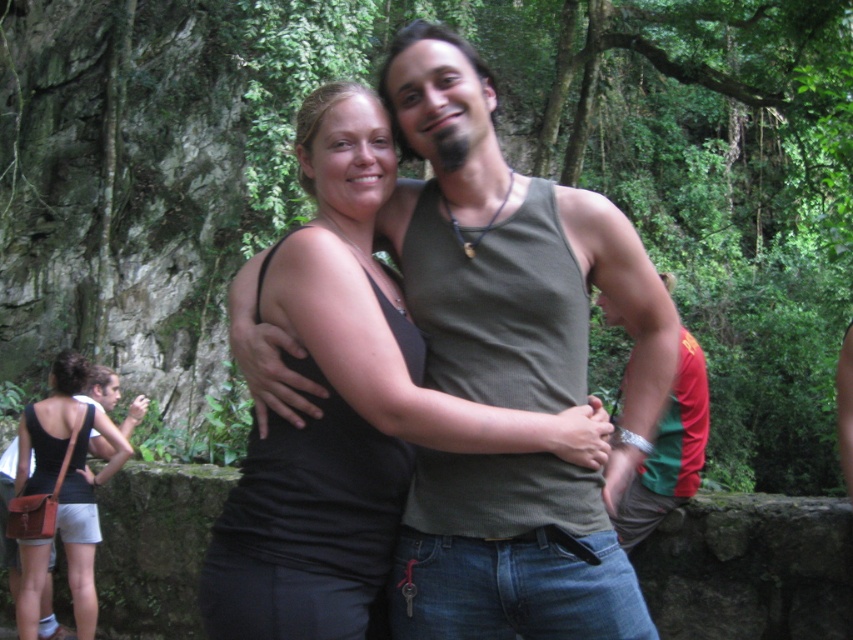
You are a photographer standing at the point marked as point (526, 588). You want to take a photo of the two people in the scene. Are they positioned close enough to each other for you to capture both in a single frame without moving the camera?

The two people are 6.98 feet apart, so yes, they are positioned close enough to each other to be captured in a single frame without moving the camera.